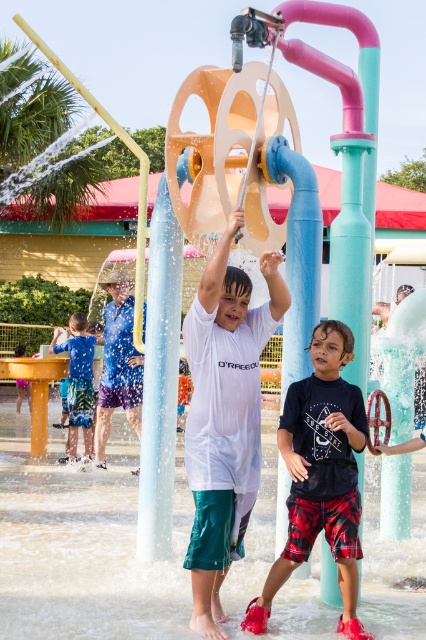
You are a parent watching your kids play at the water park. You notice the clear plastic water at center and the matte white shirt at center. Which object is wider?

The clear plastic water at center is wider than the matte white shirt at center.

You are standing at the edge of the water play area and see the white matte shirt at center. If you want to reach it in 2 seconds, what is the minimum speed you need to move towards it?

The white matte shirt at center is 6.16 meters away from viewer. To cover 6.16 meters in 2 seconds, the minimum speed required is 3.08 meters per second.